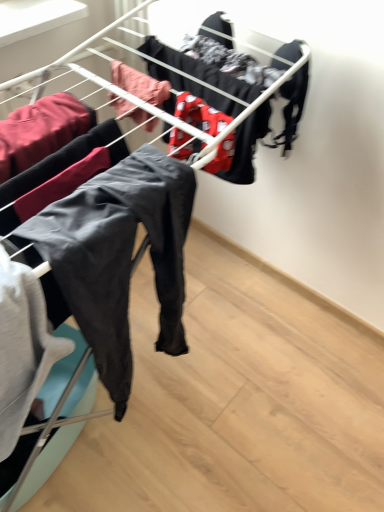
Question: Is matte black pants at center, positioned as the fourth clothing in right-to-left order, not inside matte black pants at left, the 5th clothing positioned from the right?

Choices:
 (A) no
 (B) yes

Answer: (B)

Question: Does matte black pants at center, positioned as the fourth clothing in right-to-left order, lie behind matte black pants at left, the 5th clothing positioned from the right?

Choices:
 (A) no
 (B) yes

Answer: (A)

Question: Does matte black pants at center, which is the second clothing from left to right, have a greater width compared to matte black pants at left, the 1th clothing positioned from the left?

Choices:
 (A) no
 (B) yes

Answer: (A)

Question: Considering the relative sizes of matte black pants at center, which is the second clothing from left to right, and matte black pants at left, the 5th clothing positioned from the right, in the image provided, is matte black pants at center, which is the second clothing from left to right, bigger than matte black pants at left, the 5th clothing positioned from the right,?

Choices:
 (A) no
 (B) yes

Answer: (B)

Question: Is matte black pants at center, positioned as the fourth clothing in right-to-left order, shorter than matte black pants at left, the 5th clothing positioned from the right?

Choices:
 (A) no
 (B) yes

Answer: (A)

Question: From a real-world perspective, relative to matte black pants at left, the 1th clothing positioned from the left, is red fabric with white patterns at center, marked as the second clothing in a right-to-left arrangement, vertically above or below?

Choices:
 (A) below
 (B) above

Answer: (B)

Question: Based on their sizes in the image, would you say red fabric with white patterns at center, marked as the second clothing in a right-to-left arrangement, is bigger or smaller than matte black pants at left, the 5th clothing positioned from the right?

Choices:
 (A) big
 (B) small

Answer: (B)

Question: Is red fabric with white patterns at center, marked as the second clothing in a right-to-left arrangement, inside the boundaries of matte black pants at left, the 5th clothing positioned from the right, or outside?

Choices:
 (A) outside
 (B) inside

Answer: (A)

Question: Is point pyautogui.click(x=205, y=131) positioned closer to the camera than point pyautogui.click(x=26, y=138)?

Choices:
 (A) closer
 (B) farther

Answer: (B)

Question: Is red fabric with white patterns at center, marked as the second clothing in a right-to-left arrangement, taller or shorter than matte black pants at center, which is the second clothing from left to right?

Choices:
 (A) short
 (B) tall

Answer: (A)

Question: From the image's perspective, is red fabric with white patterns at center, positioned as the 4th clothing in left-to-right order, positioned above or below matte black pants at center, which is the second clothing from left to right?

Choices:
 (A) below
 (B) above

Answer: (B)

Question: Looking at their shapes, would you say red fabric with white patterns at center, positioned as the 4th clothing in left-to-right order, is wider or thinner than matte black pants at center, which is the second clothing from left to right?

Choices:
 (A) thin
 (B) wide

Answer: (A)

Question: Looking at the image, does red fabric with white patterns at center, marked as the second clothing in a right-to-left arrangement, seem bigger or smaller compared to matte black pants at center, positioned as the fourth clothing in right-to-left order?

Choices:
 (A) big
 (B) small

Answer: (B)

Question: Considering the positions of black matte underwear at upper right, the 5th clothing from the left, and matte black pants at left, the 1th clothing positioned from the left, in the image, is black matte underwear at upper right, the 5th clothing from the left, wider or thinner than matte black pants at left, the 1th clothing positioned from the left,?

Choices:
 (A) thin
 (B) wide

Answer: (A)

Question: In the image, is black matte underwear at upper right, the first clothing in the right-to-left sequence, positioned in front of or behind matte black pants at left, the 1th clothing positioned from the left?

Choices:
 (A) behind
 (B) front

Answer: (A)